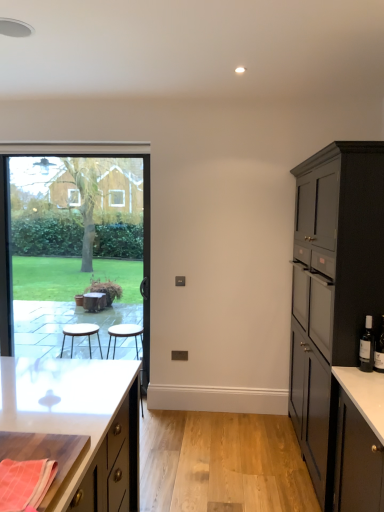
Question: From a real-world perspective, is transparent glass window at left beneath dark glass wine bottle at right?

Choices:
 (A) yes
 (B) no

Answer: (B)

Question: Can you confirm if transparent glass window at left is smaller than dark glass wine bottle at right?

Choices:
 (A) yes
 (B) no

Answer: (B)

Question: From a real-world perspective, is transparent glass window at left positioned over dark glass wine bottle at right based on gravity?

Choices:
 (A) yes
 (B) no

Answer: (A)

Question: Does transparent glass window at left have a greater width compared to dark glass wine bottle at right?

Choices:
 (A) yes
 (B) no

Answer: (A)

Question: Is transparent glass window at left thinner than dark glass wine bottle at right?

Choices:
 (A) no
 (B) yes

Answer: (A)

Question: From the image's perspective, is transparent glass window at left located above dark glass wine bottle at right?

Choices:
 (A) no
 (B) yes

Answer: (B)

Question: Considering the relative sizes of orange woven cloth at lower left and black glass bottle at right in the image provided, is orange woven cloth at lower left taller than black glass bottle at right?

Choices:
 (A) no
 (B) yes

Answer: (A)

Question: Does orange woven cloth at lower left have a larger size compared to black glass bottle at right?

Choices:
 (A) no
 (B) yes

Answer: (B)

Question: Is orange woven cloth at lower left closer to the viewer compared to black glass bottle at right?

Choices:
 (A) yes
 (B) no

Answer: (A)

Question: Does orange woven cloth at lower left appear on the left side of black glass bottle at right?

Choices:
 (A) yes
 (B) no

Answer: (A)

Question: Is orange woven cloth at lower left in contact with black glass bottle at right?

Choices:
 (A) no
 (B) yes

Answer: (A)

Question: Can you confirm if orange woven cloth at lower left is wider than black glass bottle at right?

Choices:
 (A) yes
 (B) no

Answer: (A)

Question: Does wooden cutting board at lower left, the second cabinetry from the right, come in front of matte black cabinet at right, marked as the 1th cabinetry in a right-to-left arrangement?

Choices:
 (A) yes
 (B) no

Answer: (B)